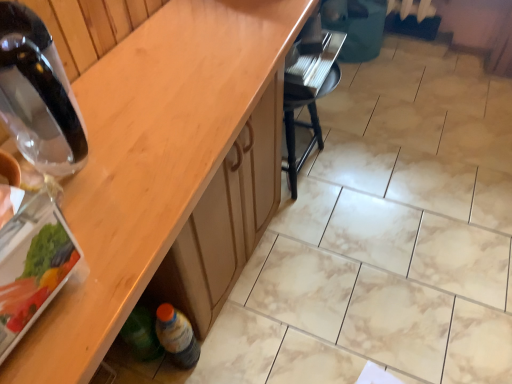
Identify the location of empty space that is ontop of wooden at lower left (from a real-world perspective). (187, 84).